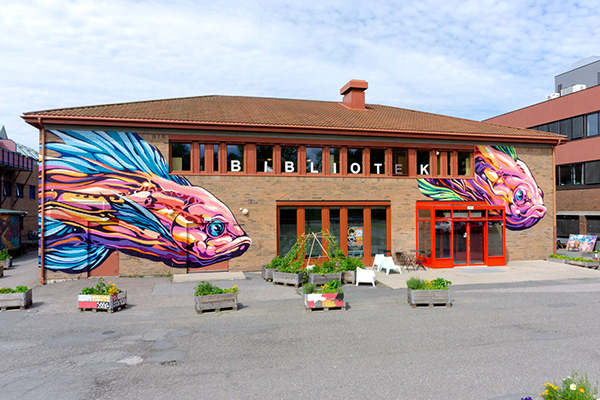
Find the location of a particular element. entrance is located at coordinates (468, 240).